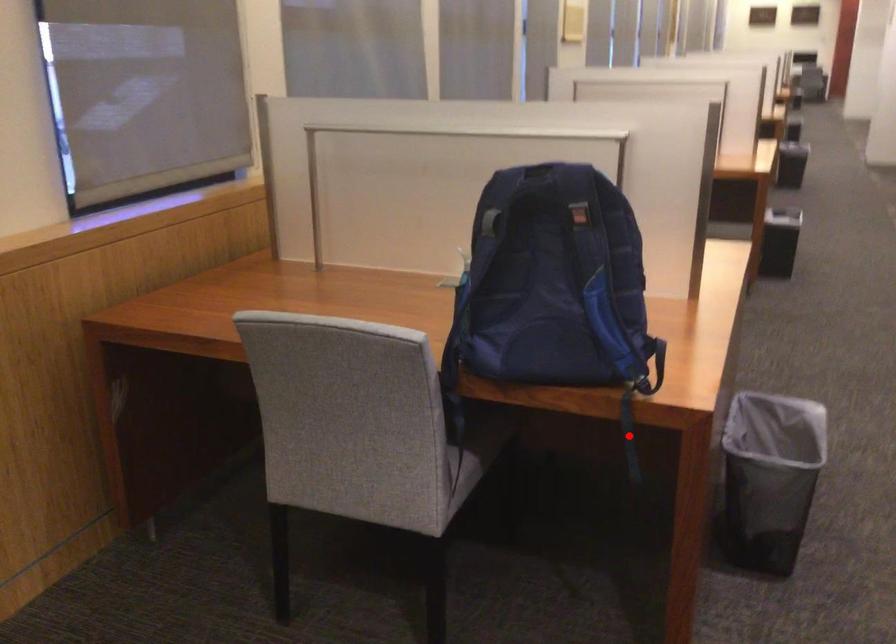
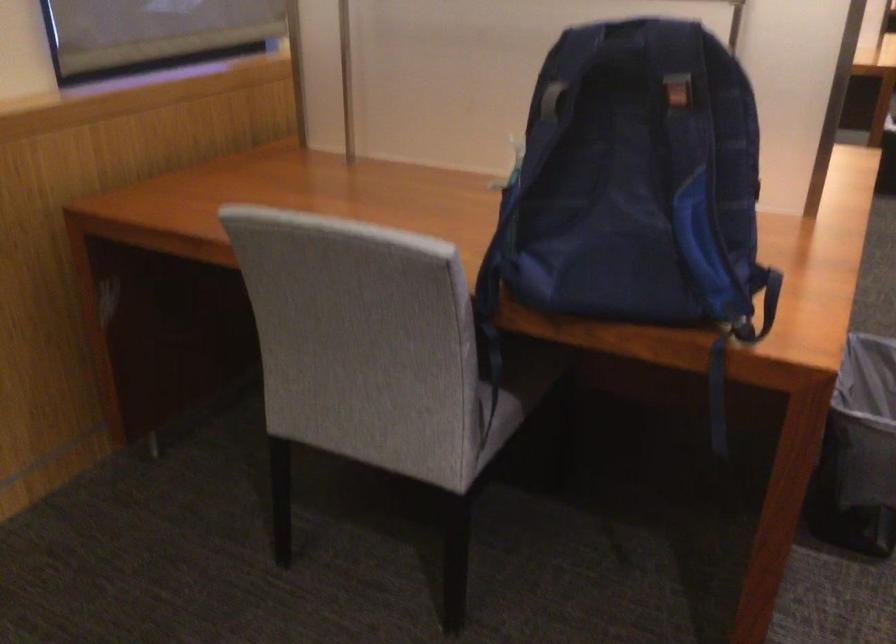
In the second image, find the point that corresponds to the highlighted location in the first image.

(718, 395)